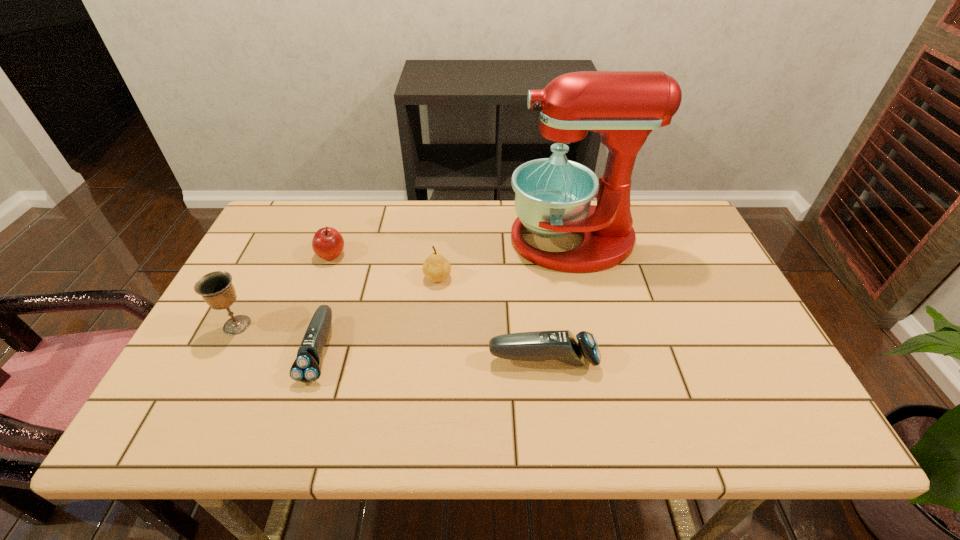
Where is `the left electric shaver`? The width and height of the screenshot is (960, 540). the left electric shaver is located at coordinates (306, 368).

Identify the location of the shortest object. (306, 368).

Find the location of `the right electric shaver`. the right electric shaver is located at coordinates (563, 346).

Where is `the tallest object`? This screenshot has height=540, width=960. the tallest object is located at coordinates [553, 195].

Where is `the leftmost object`? The height and width of the screenshot is (540, 960). the leftmost object is located at coordinates (216, 288).

The height and width of the screenshot is (540, 960). I want to click on chalice, so click(x=216, y=288).

Find the location of a particular element. pear is located at coordinates (436, 267).

Identify the location of apple. The height and width of the screenshot is (540, 960). (328, 243).

You are a GUI agent. You are given a task and a screenshot of the screen. Output one action in this format:
    pyautogui.click(x=<x>, y=<y>)
    Task: Click on the free space located on the head of the taller electric shaver
    The image size is (960, 540).
    Given the screenshot: What is the action you would take?
    click(x=744, y=360)

The width and height of the screenshot is (960, 540). Find the location of `vacant space located on the front-facing side of the mixer`. vacant space located on the front-facing side of the mixer is located at coordinates (409, 240).